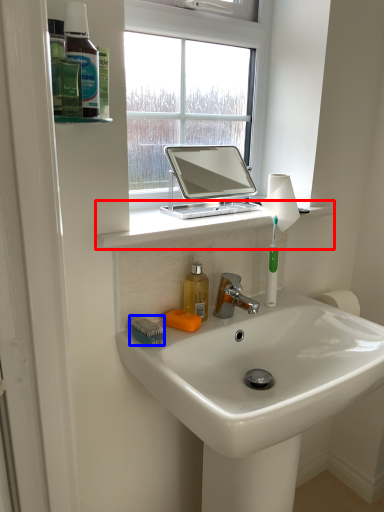
Question: Which object is closer to the camera taking this photo, counter top (highlighted by a red box) or brush (highlighted by a blue box)?

Choices:
 (A) counter top
 (B) brush

Answer: (A)